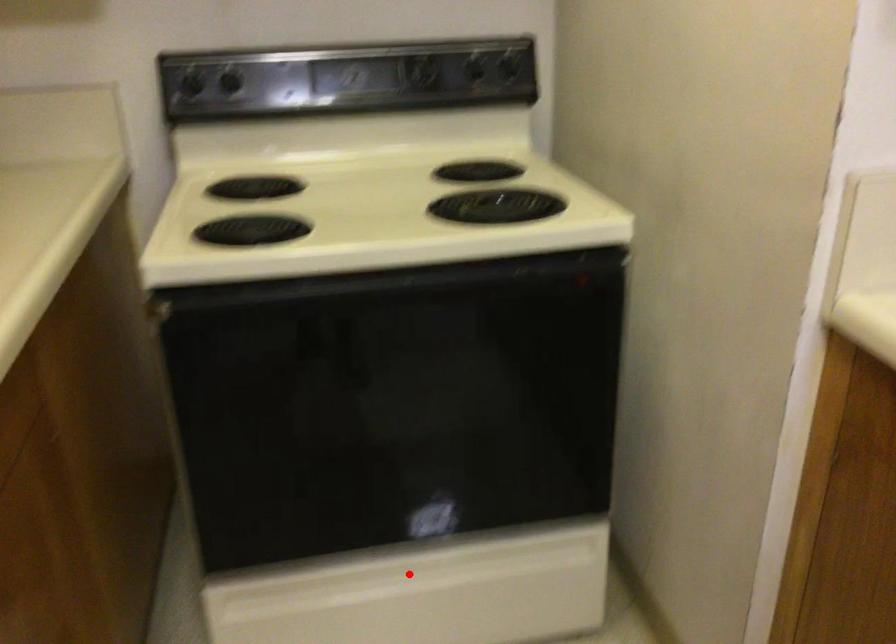
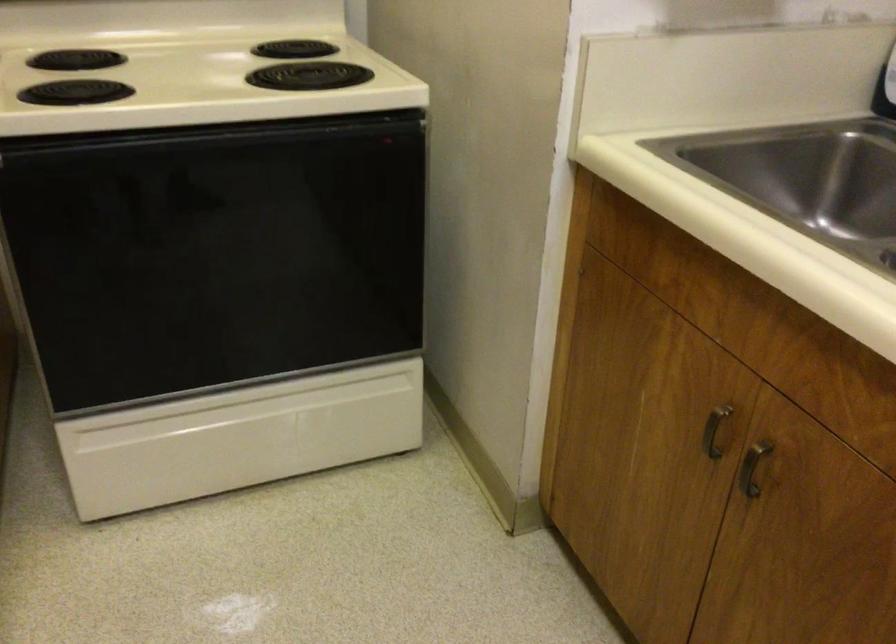
Locate, in the second image, the point that corresponds to the highlighted location in the first image.

(250, 410)